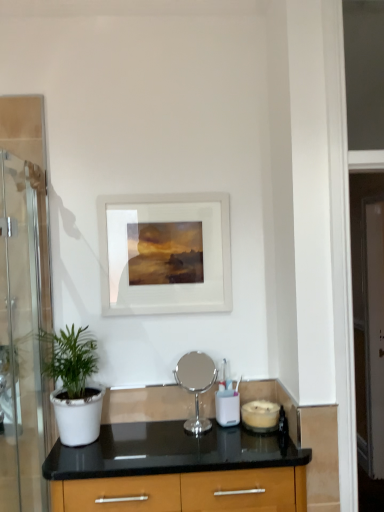
Question: From the image's perspective, is silver metallic mirror at center, marked as the second appliance in a right-to-left arrangement, located above transparent glass screen door at left, the second screen door viewed from the back?

Choices:
 (A) yes
 (B) no

Answer: (B)

Question: From the image's perspective, is silver metallic mirror at center, the first appliance in the left-to-right sequence, beneath transparent glass screen door at left, acting as the 1th screen door starting from the front?

Choices:
 (A) no
 (B) yes

Answer: (B)

Question: Is silver metallic mirror at center, marked as the second appliance in a right-to-left arrangement, aimed at transparent glass screen door at left, acting as the 1th screen door starting from the front?

Choices:
 (A) no
 (B) yes

Answer: (A)

Question: Does silver metallic mirror at center, the first appliance in the left-to-right sequence, touch transparent glass screen door at left, the second screen door viewed from the back?

Choices:
 (A) yes
 (B) no

Answer: (B)

Question: Is silver metallic mirror at center, the first appliance in the left-to-right sequence, positioned with its back to transparent glass screen door at left, placed as the first screen door when sorted from left to right?

Choices:
 (A) yes
 (B) no

Answer: (B)

Question: In the image, is green matte plant at left positioned in front of or behind white matte picture frame at center?

Choices:
 (A) behind
 (B) front

Answer: (B)

Question: Is green matte plant at left taller or shorter than white matte picture frame at center?

Choices:
 (A) short
 (B) tall

Answer: (A)

Question: Based on their positions, is green matte plant at left located to the left or right of white matte picture frame at center?

Choices:
 (A) right
 (B) left

Answer: (B)

Question: Looking at the image, does green matte plant at left seem bigger or smaller compared to white matte picture frame at center?

Choices:
 (A) big
 (B) small

Answer: (A)

Question: Considering their positions, is green matte plant at left located in front of or behind matte glass candle at lower right, the first appliance when ordered from right to left?

Choices:
 (A) front
 (B) behind

Answer: (A)

Question: In the image, is green matte plant at left on the left side or the right side of matte glass candle at lower right, the first appliance when ordered from right to left?

Choices:
 (A) left
 (B) right

Answer: (A)

Question: In terms of height, does green matte plant at left look taller or shorter compared to matte glass candle at lower right, the first appliance when ordered from right to left?

Choices:
 (A) short
 (B) tall

Answer: (B)

Question: Is point (77, 353) closer or farther from the camera than point (249, 418)?

Choices:
 (A) closer
 (B) farther

Answer: (A)

Question: From a real-world perspective, is matte glass candle at lower right, the 2th appliance positioned from the left, positioned above or below green matte plant at left?

Choices:
 (A) above
 (B) below

Answer: (B)

Question: Considering the relative positions of matte glass candle at lower right, the 2th appliance positioned from the left, and green matte plant at left in the image provided, is matte glass candle at lower right, the 2th appliance positioned from the left, to the left or to the right of green matte plant at left?

Choices:
 (A) right
 (B) left

Answer: (A)